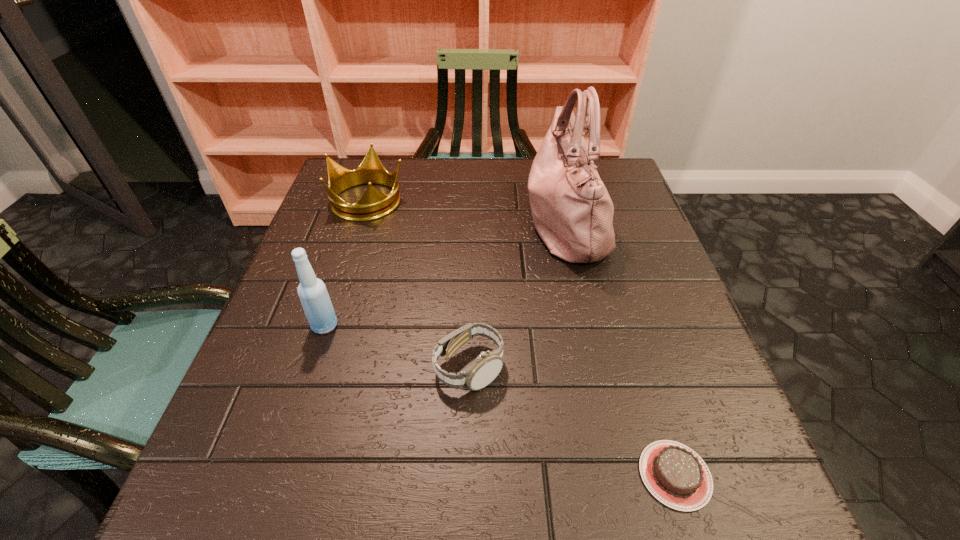
Image resolution: width=960 pixels, height=540 pixels. What are the coordinates of `free space between the second tallest object and the third tallest object` in the screenshot? It's located at (347, 263).

At what (x,y) coordinates should I click in order to perform the action: click on free space between the third shortest object and the chocolate cake. Please return your answer as a coordinate pair (x, y). This screenshot has width=960, height=540. Looking at the image, I should click on (521, 338).

Find the location of `object that stands as the third closest to the handbag`. object that stands as the third closest to the handbag is located at coordinates (677, 476).

Identify which object is located as the nearest to the chocolate cake. Please provide its 2D coordinates. Your answer should be formatted as a tuple, i.e. [(x, y)], where the tuple contains the x and y coordinates of a point satisfying the conditions above.

[(481, 372)]

At what (x,y) coordinates should I click in order to perform the action: click on free space that satisfies the following two spatial constraints: 1. on the face of the shortest object; 2. on the right side of the fourth farthest object. Please return your answer as a coordinate pair (x, y). This screenshot has width=960, height=540. Looking at the image, I should click on (467, 475).